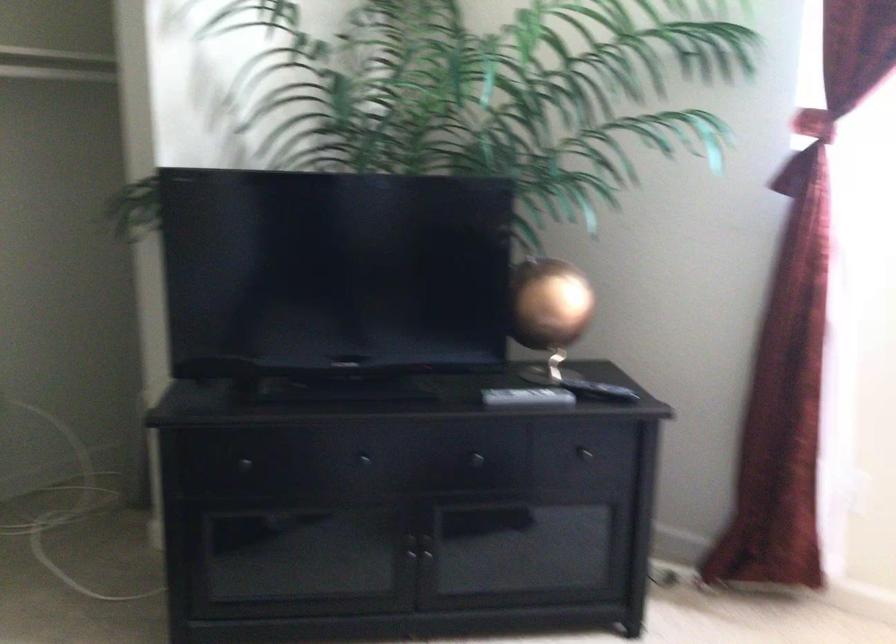
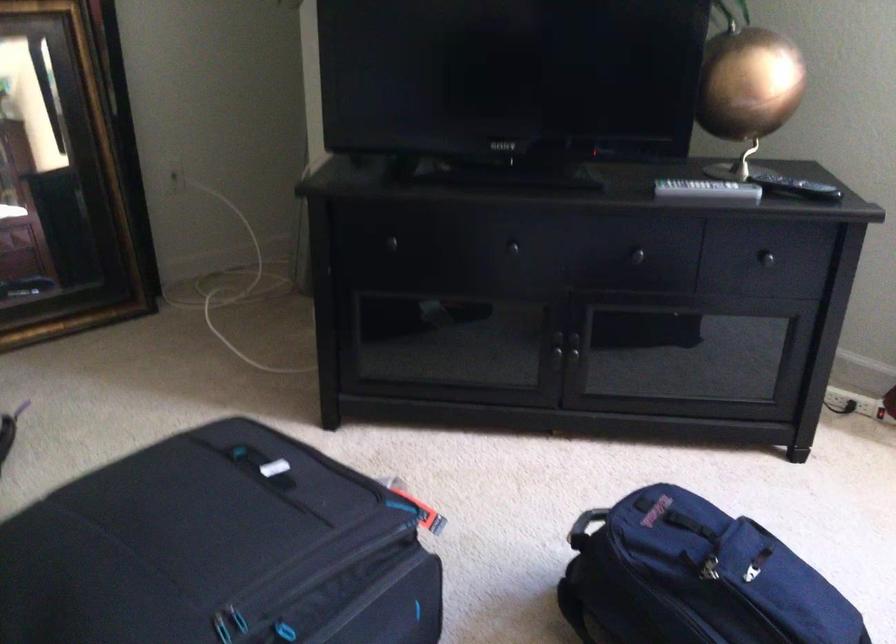
Question: The camera is either moving clockwise (left) or counter-clockwise (right) around the object. The first image is from the beginning of the video and the second image is from the end. Is the camera moving left or right when shooting the video?

Choices:
 (A) Left
 (B) Right

Answer: (B)